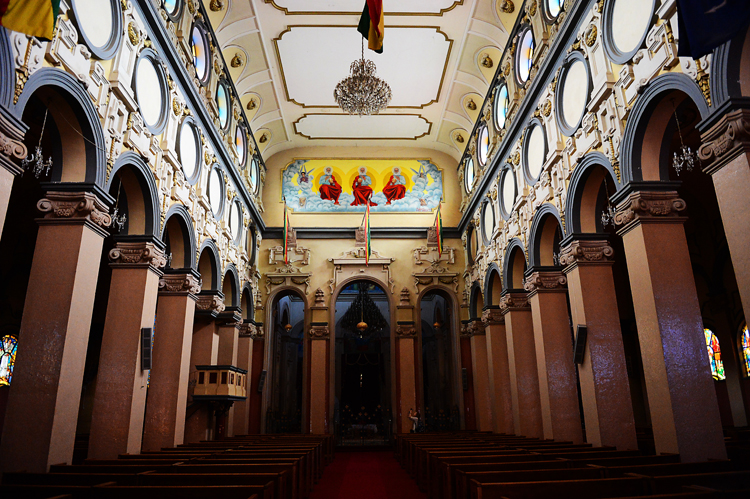
The height and width of the screenshot is (499, 750). In order to click on white ceiling walls in this screenshot , I will do `click(315, 45)`.